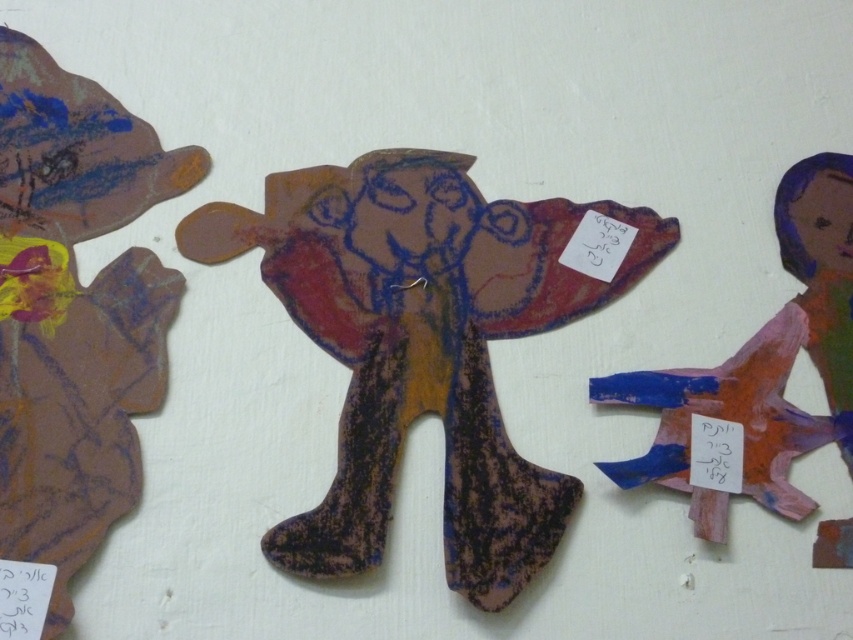
Question: Is matte brown paper doll at center bigger than matte brown paper doll at right?

Choices:
 (A) yes
 (B) no

Answer: (A)

Question: Is matte brown paper doll at center wider than matte brown paper doll at right?

Choices:
 (A) yes
 (B) no

Answer: (A)

Question: Which object appears closest to the camera in this image?

Choices:
 (A) matte brown paper doll at center
 (B) matte brown paper doll at right

Answer: (A)

Question: Which object is closer to the camera taking this photo?

Choices:
 (A) matte brown paper doll at center
 (B) matte brown paper doll at right

Answer: (A)

Question: Is matte brown paper doll at center above matte brown paper doll at right?

Choices:
 (A) yes
 (B) no

Answer: (B)

Question: Among these points, which one is nearest to the camera?

Choices:
 (A) (503, 454)
 (B) (819, 525)

Answer: (B)